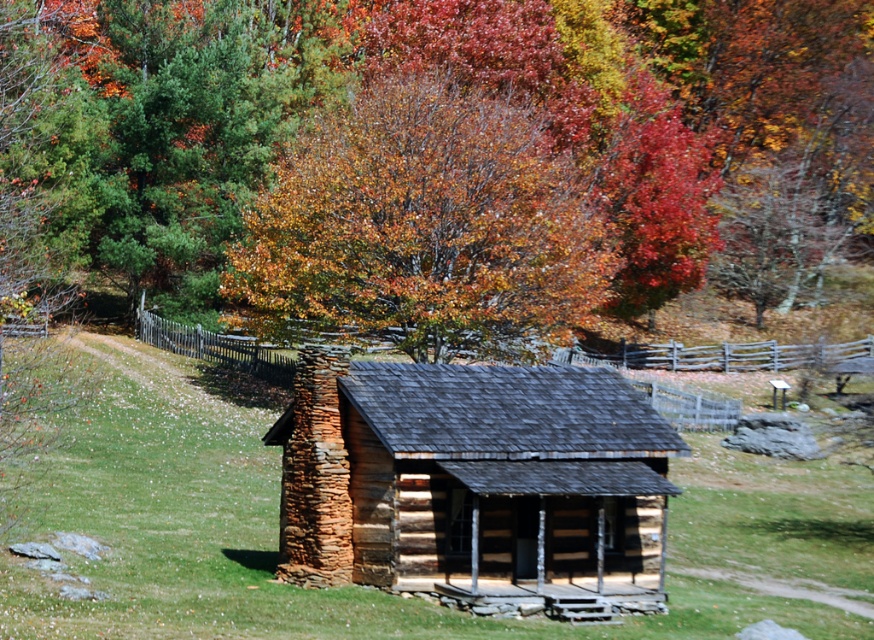
Does wooden log cabin at center appear under autumn leaves at upper center?

Yes, wooden log cabin at center is below autumn leaves at upper center.

I want to click on wooden log cabin at center, so click(x=474, y=481).

What do you see at coordinates (474, 481) in the screenshot? The height and width of the screenshot is (640, 874). I see `wooden log cabin at center` at bounding box center [474, 481].

Locate an element on the screen. The width and height of the screenshot is (874, 640). wooden log cabin at center is located at coordinates (474, 481).

Which is behind, point (260, 604) or point (533, 188)?

The point (533, 188) is behind.

Identify the location of green grass at center. The height and width of the screenshot is (640, 874). (364, 586).

Consider the image. Can you confirm if green grass at center is bigger than wooden log cabin at center?

Indeed, green grass at center has a larger size compared to wooden log cabin at center.

Does green grass at center have a lesser height compared to wooden log cabin at center?

No.

Which is behind, point (81, 636) or point (445, 403)?

The point (445, 403) is behind.

The width and height of the screenshot is (874, 640). Identify the location of green grass at center. (364, 586).